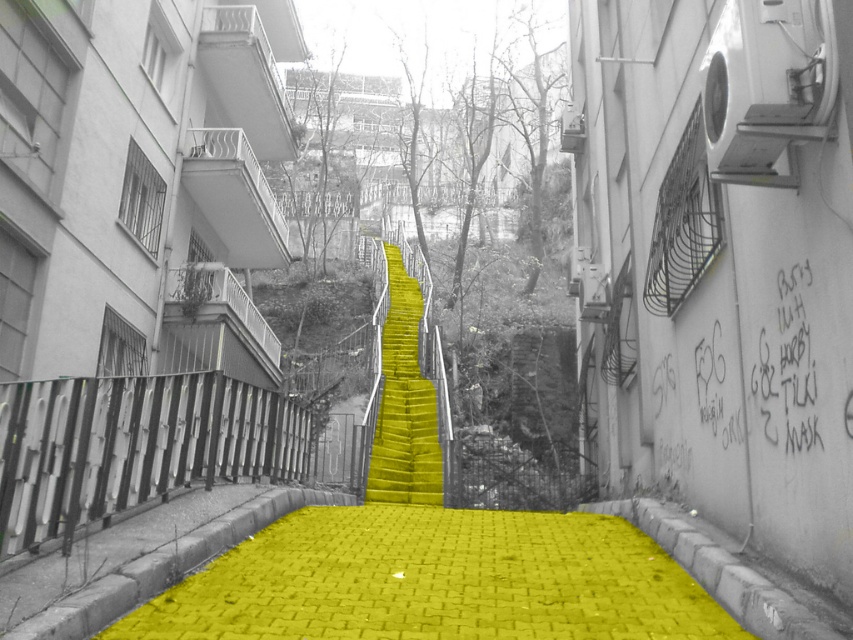
Is yellow brick path at center behind yellow matte stairs at center?

No, it is in front of yellow matte stairs at center.

Does yellow brick path at center appear on the right side of yellow matte stairs at center?

Yes, yellow brick path at center is to the right of yellow matte stairs at center.

What do you see at coordinates (434, 580) in the screenshot? Image resolution: width=853 pixels, height=640 pixels. I see `yellow brick path at center` at bounding box center [434, 580].

Find the location of `yellow brick path at center`. yellow brick path at center is located at coordinates (434, 580).